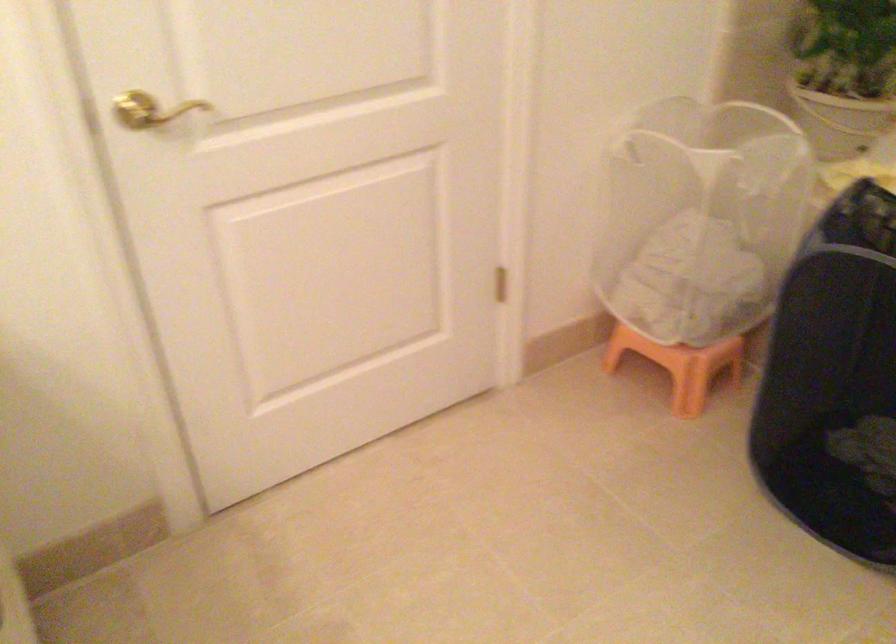
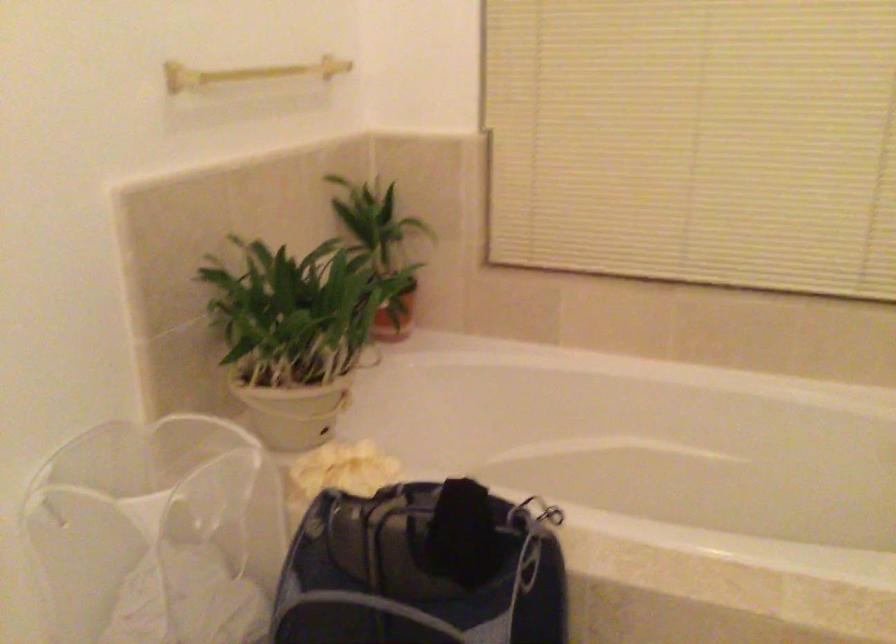
Find the pixel in the second image that matches pixel 705 183 in the first image.

(157, 534)